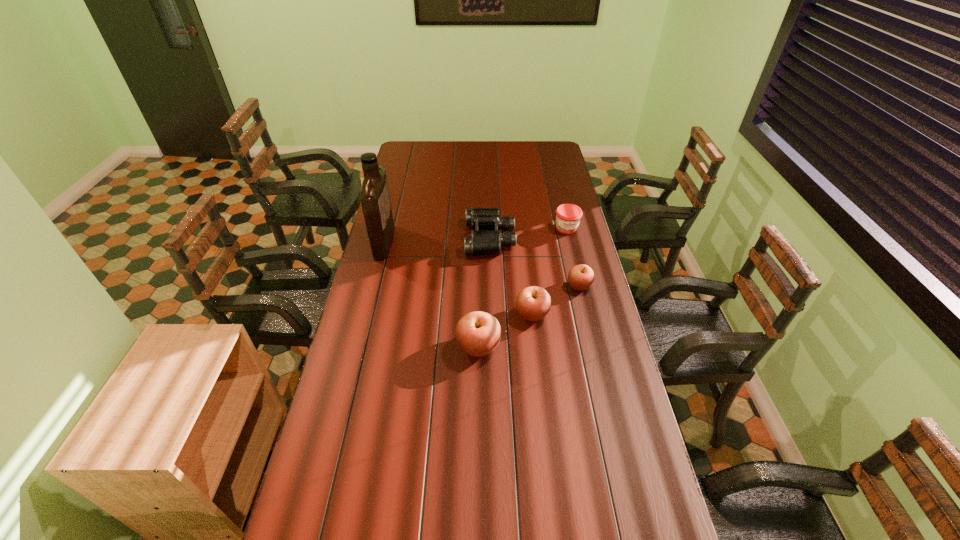
What are the coordinates of `vacant point located 0.050m on the front of the tallest apple` in the screenshot? It's located at (478, 379).

Identify the location of free location located on the left of the second farthest apple. (490, 314).

Where is `vacant position located on the back of the fourth farthest object`? This screenshot has height=540, width=960. vacant position located on the back of the fourth farthest object is located at coordinates (571, 253).

Locate an element on the screen. vacant space located 0.180m on the front-facing side of the binoculars is located at coordinates (423, 238).

In order to click on vacant position located 0.230m on the front-facing side of the binoculars in this screenshot , I will do `click(412, 238)`.

Locate an element on the screen. vacant space situated on the front-facing side of the binoculars is located at coordinates (387, 238).

At what (x,y) coordinates should I click in order to perform the action: click on vacant position located on the label side of the liquor. Please return your answer as a coordinate pair (x, y). Image resolution: width=960 pixels, height=540 pixels. Looking at the image, I should click on (449, 242).

Find the location of a particular element. The image size is (960, 540). vacant area situated on the label side of the jam is located at coordinates (582, 291).

The height and width of the screenshot is (540, 960). What are the coordinates of `object that is positioned at the left edge` in the screenshot? It's located at (375, 200).

Identify the location of apple that is at the right edge. (580, 277).